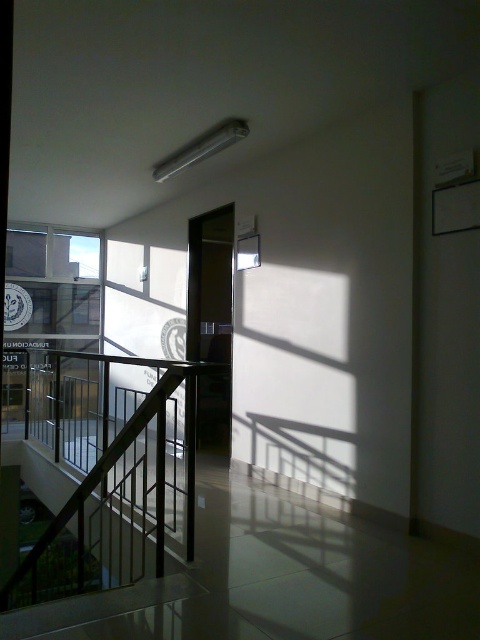
Is black metal railing at center above transparent glass window at upper left?

No.

Is black metal railing at center further to camera compared to transparent glass window at upper left?

No, it is in front of transparent glass window at upper left.

This screenshot has width=480, height=640. Describe the element at coordinates (110, 476) in the screenshot. I see `black metal railing at center` at that location.

This screenshot has height=640, width=480. What are the coordinates of `black metal railing at center` in the screenshot? It's located at (110, 476).